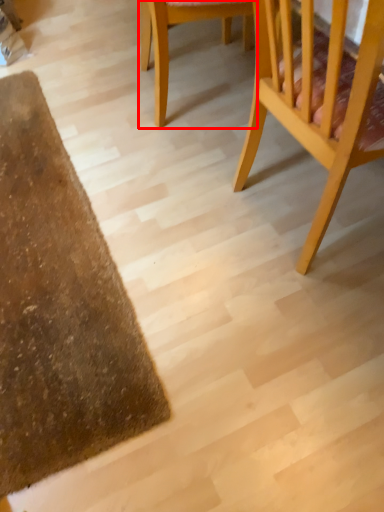
Question: From the image's perspective, what is the correct spatial positioning of chair (annotated by the red box) in reference to chair?

Choices:
 (A) above
 (B) below

Answer: (A)